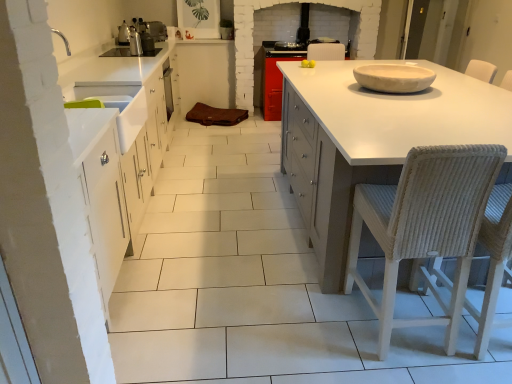
Question: Is the surface of white matte countertop at center in direct contact with woven wicker chair at right, which appears as the second chair when viewed from the right?

Choices:
 (A) no
 (B) yes

Answer: (A)

Question: Can you confirm if white matte countertop at center is bigger than woven wicker chair at right, arranged as the first chair when viewed from the left?

Choices:
 (A) no
 (B) yes

Answer: (B)

Question: Is white matte countertop at center at the left side of woven wicker chair at right, which appears as the second chair when viewed from the right?

Choices:
 (A) yes
 (B) no

Answer: (B)

Question: Is white matte countertop at center at the right side of woven wicker chair at right, arranged as the first chair when viewed from the left?

Choices:
 (A) yes
 (B) no

Answer: (A)

Question: Would you say woven wicker chair at right, arranged as the first chair when viewed from the left, is part of white matte countertop at center's contents?

Choices:
 (A) yes
 (B) no

Answer: (A)

Question: Looking at the image, does woven wicker chair at right, which appears as the second chair when viewed from the right, seem bigger or smaller compared to woven straw chair at right, the 2th chair when ordered from left to right?

Choices:
 (A) big
 (B) small

Answer: (A)

Question: Does point (348, 286) appear closer or farther from the camera than point (499, 276)?

Choices:
 (A) farther
 (B) closer

Answer: (A)

Question: Considering the positions of woven wicker chair at right, arranged as the first chair when viewed from the left, and woven straw chair at right, the 2th chair when ordered from left to right, in the image, is woven wicker chair at right, arranged as the first chair when viewed from the left, wider or thinner than woven straw chair at right, the 2th chair when ordered from left to right,?

Choices:
 (A) thin
 (B) wide

Answer: (A)

Question: From the image's perspective, is woven wicker chair at right, which appears as the second chair when viewed from the right, above or below woven straw chair at right, the 2th chair when ordered from left to right?

Choices:
 (A) below
 (B) above

Answer: (A)

Question: Is white matte countertop at center wider or thinner than woven wicker chair at right, which appears as the second chair when viewed from the right?

Choices:
 (A) thin
 (B) wide

Answer: (B)

Question: Is point (318, 180) positioned closer to the camera than point (420, 256)?

Choices:
 (A) closer
 (B) farther

Answer: (B)

Question: Relative to woven wicker chair at right, arranged as the first chair when viewed from the left, is white matte countertop at center in front or behind?

Choices:
 (A) front
 (B) behind

Answer: (B)

Question: From the image's perspective, is white matte countertop at center above or below woven wicker chair at right, arranged as the first chair when viewed from the left?

Choices:
 (A) above
 (B) below

Answer: (A)

Question: From a real-world perspective, is white ceramic bowl at upper right physically located above or below woven wicker chair at right, which appears as the second chair when viewed from the right?

Choices:
 (A) below
 (B) above

Answer: (B)

Question: In terms of height, does white ceramic bowl at upper right look taller or shorter compared to woven wicker chair at right, which appears as the second chair when viewed from the right?

Choices:
 (A) tall
 (B) short

Answer: (B)